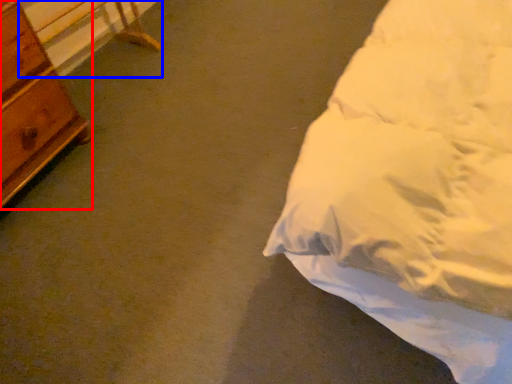
Question: Which object is closer to the camera taking this photo, chest of drawers (highlighted by a red box) or table (highlighted by a blue box)?

Choices:
 (A) chest of drawers
 (B) table

Answer: (A)